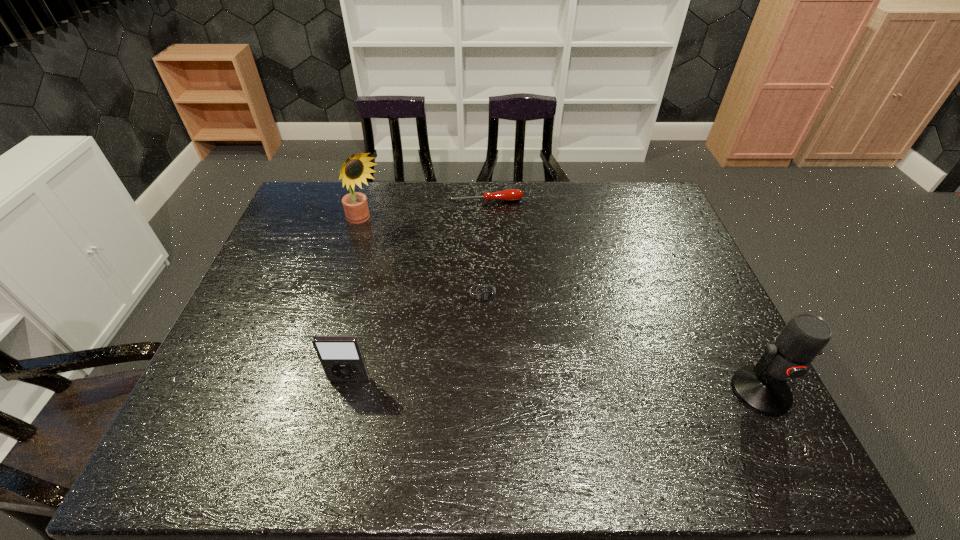
Identify the location of iPod. (342, 359).

Where is `the rightmost object`? This screenshot has height=540, width=960. the rightmost object is located at coordinates (762, 388).

Identify the location of the second shortest object. (511, 194).

The image size is (960, 540). In order to click on screwdriver in this screenshot , I will do `click(511, 194)`.

Where is `watch`? watch is located at coordinates (485, 294).

You are a GUI agent. You are given a task and a screenshot of the screen. Output one action in this format:
    pyautogui.click(x=<x>, y=<y>)
    Task: Click on the shortest object
    The width and height of the screenshot is (960, 540).
    Given the screenshot: What is the action you would take?
    (485, 294)

The image size is (960, 540). What are the coordinates of `sunflower` in the screenshot? It's located at (355, 170).

What are the coordinates of `blank space located on the front-facing side of the third shortest object` in the screenshot? It's located at (343, 410).

Locate an element on the screen. This screenshot has height=540, width=960. free space located 0.060m at the tip of the second shortest object is located at coordinates (491, 214).

Where is `vacant space located at the tip of the second shortest object`? The image size is (960, 540). vacant space located at the tip of the second shortest object is located at coordinates (497, 250).